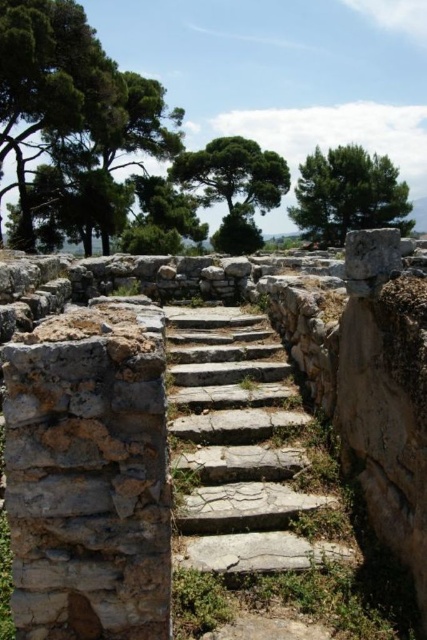
Does point (128, 88) come in front of point (301, 202)?

That is True.

Is green leafy tree at upper left thinner than green leafy tree at upper right?

Yes.

Does point (2, 51) lie behind point (310, 166)?

That is False.

Identify the location of green leafy tree at upper left. The width and height of the screenshot is (427, 640). (73, 86).

Is point (351, 218) closer to viewer compared to point (236, 157)?

No, (351, 218) is behind (236, 157).

Who is higher up, green leafy tree at upper right or green leafy tree at upper center?

green leafy tree at upper center

Which is in front, point (391, 186) or point (228, 209)?

Point (391, 186)

Locate an element on the screen. The height and width of the screenshot is (640, 427). green leafy tree at upper right is located at coordinates (348, 195).

Does green leafy tree at upper left appear over green leafy tree at upper center?

Incorrect, green leafy tree at upper left is not positioned above green leafy tree at upper center.

Can you confirm if green leafy tree at upper left is positioned to the right of green leafy tree at upper center?

No, green leafy tree at upper left is not to the right of green leafy tree at upper center.

Identify the location of green leafy tree at upper left. (73, 86).